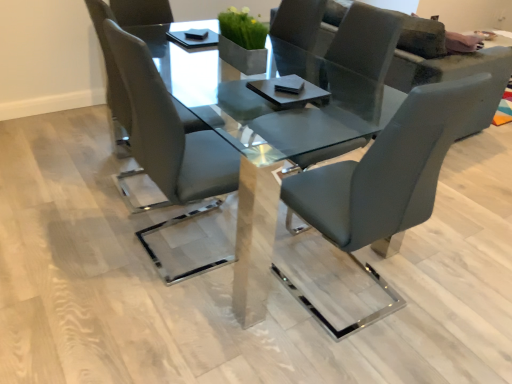
The image size is (512, 384). I want to click on empty space that is to the right of matte gray chair at center, arranged as the third chair when viewed from the left, so click(x=451, y=307).